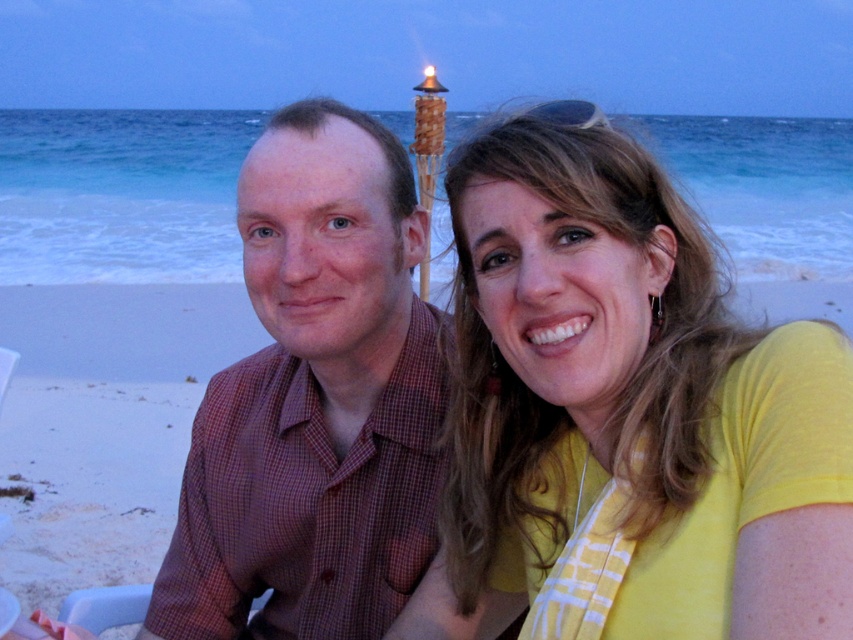
Is yellow fabric at upper right shorter than plaid shirt at center?

Indeed, yellow fabric at upper right has a lesser height compared to plaid shirt at center.

Is yellow fabric at upper right further to camera compared to plaid shirt at center?

No, it is not.

Who is more distant from viewer, (440, 564) or (285, 300)?

Positioned behind is point (440, 564).

Where is `yellow fabric at upper right`? This screenshot has width=853, height=640. yellow fabric at upper right is located at coordinates (625, 413).